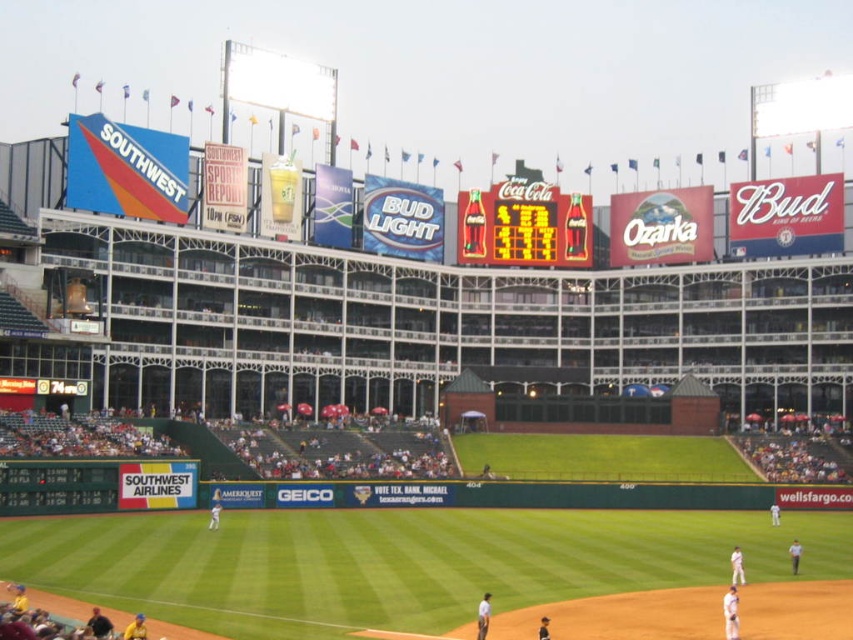
Is point (665, 556) in front of point (573, 260)?

Yes, it is.

Is green grass at center further to camera compared to shiny plastic coca-cola sign at center?

No.

Is point (805, 564) less distant than point (497, 212)?

Yes, it is.

This screenshot has width=853, height=640. Find the location of `green grass at center`. green grass at center is located at coordinates (402, 563).